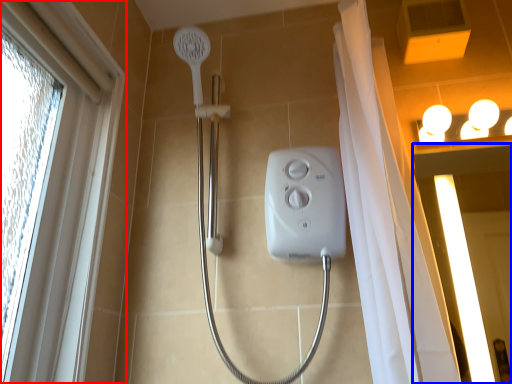
Question: Among these objects, which one is farthest to the camera, window (highlighted by a red box) or screen door (highlighted by a blue box)?

Choices:
 (A) window
 (B) screen door

Answer: (B)